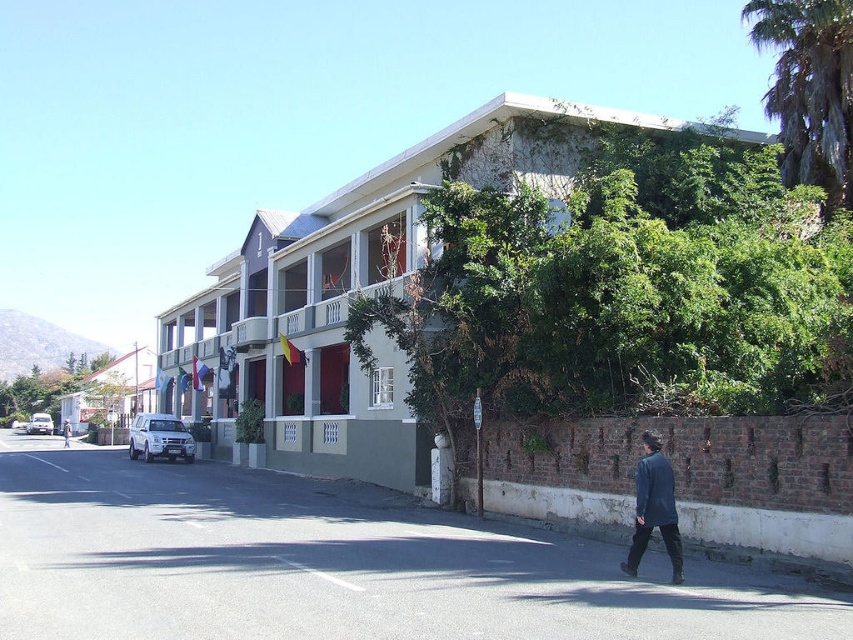
Question: Which of the following is the closest to the observer?

Choices:
 (A) green leafy palm tree at upper right
 (B) light blue denim jacket at lower right
 (C) dark blue fabric coat at lower right

Answer: (C)

Question: Which point is farther to the camera?

Choices:
 (A) (657, 506)
 (B) (67, 422)

Answer: (B)

Question: Which of the following is the closest to the observer?

Choices:
 (A) green leafy palm tree at upper right
 (B) dark blue fabric coat at lower right
 (C) light blue denim jacket at lower right

Answer: (B)

Question: Is green leafy palm tree at upper right below dark blue fabric coat at lower right?

Choices:
 (A) no
 (B) yes

Answer: (A)

Question: Is green leafy palm tree at upper right above dark blue fabric coat at lower right?

Choices:
 (A) no
 (B) yes

Answer: (B)

Question: From the image, what is the correct spatial relationship of dark blue fabric coat at lower right in relation to light blue denim jacket at lower right?

Choices:
 (A) above
 (B) below

Answer: (A)